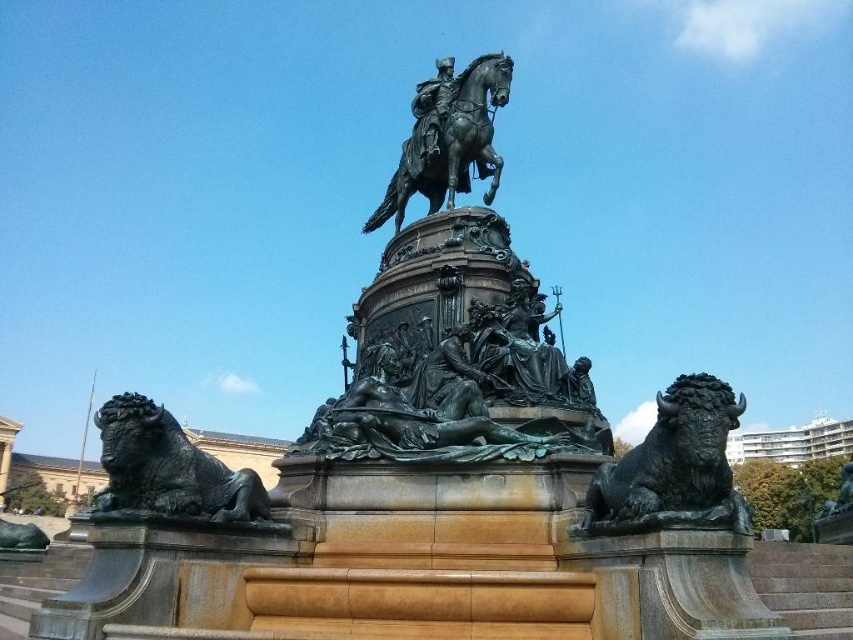
Is point (485, 67) closer to viewer compared to point (436, 61)?

That is True.

Who is more forward, (x=416, y=179) or (x=438, y=150)?

Point (x=438, y=150)

What are the coordinates of `polished bronze horse at center` in the screenshot? It's located at [x=448, y=138].

Does bronze textured bison at lower right have a smaller size compared to polished bronze horse at center?

Yes.

Who is more distant from viewer, (724, 394) or (502, 166)?

The point (502, 166) is more distant.

At what (x,y) coordinates should I click in order to perform the action: click on bronze textured bison at lower right. Please return your answer as a coordinate pair (x, y). Image resolution: width=853 pixels, height=640 pixels. Looking at the image, I should click on (672, 467).

Can you confirm if bronze/statue at lower left is positioned to the left of polished bronze statue at center?

Correct, you'll find bronze/statue at lower left to the left of polished bronze statue at center.

Does bronze/statue at lower left have a greater width compared to polished bronze statue at center?

Correct, the width of bronze/statue at lower left exceeds that of polished bronze statue at center.

Does point (152, 481) come in front of point (416, 147)?

Yes, it is in front of point (416, 147).

The width and height of the screenshot is (853, 640). Find the location of `bronze/statue at lower left`. bronze/statue at lower left is located at coordinates (167, 468).